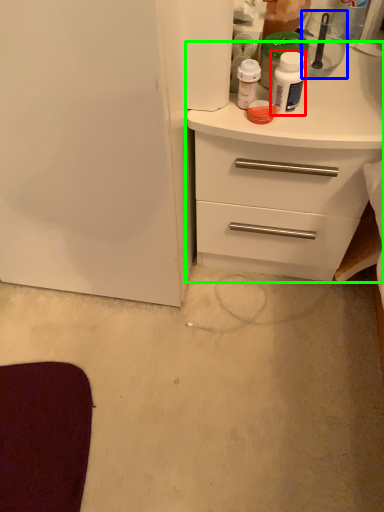
Question: Which is farther away from bottle (highlighted by a red box)? appliance (highlighted by a blue box) or chest of drawers (highlighted by a green box)?

Choices:
 (A) appliance
 (B) chest of drawers

Answer: (A)